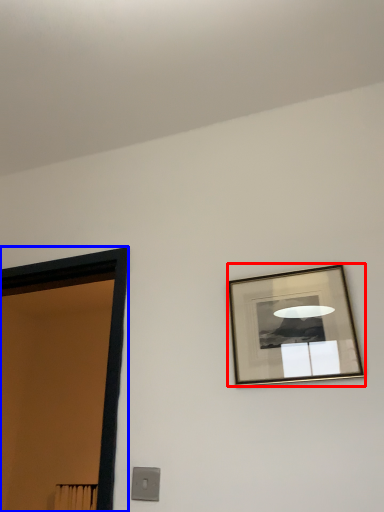
Question: Among these objects, which one is nearest to the camera, picture frame (highlighted by a red box) or door (highlighted by a blue box)?

Choices:
 (A) picture frame
 (B) door

Answer: (A)